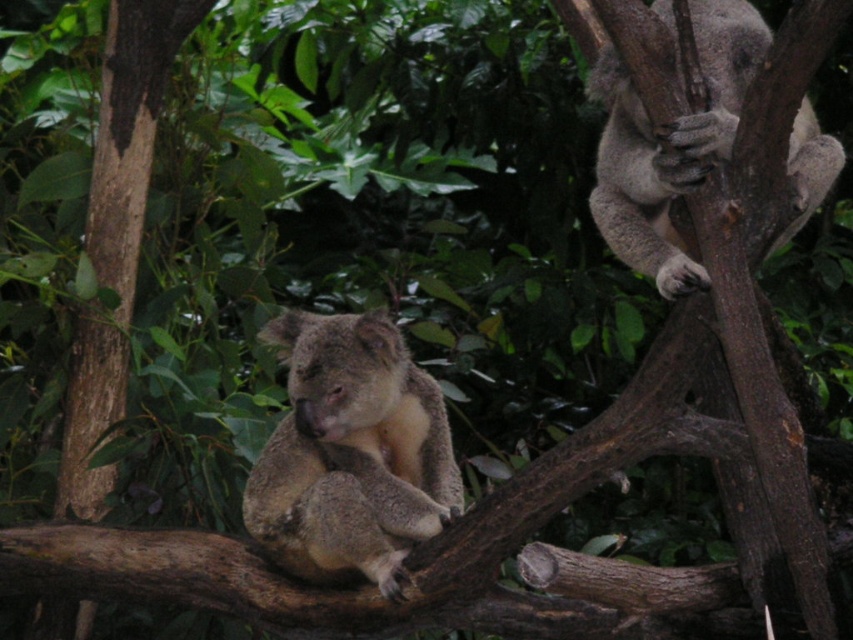
Question: From the image, what is the correct spatial relationship of fuzzy brown koala at center in relation to fuzzy gray koala at upper right?

Choices:
 (A) below
 (B) above

Answer: (A)

Question: Is the position of fuzzy brown koala at center less distant than that of fuzzy gray koala at upper right?

Choices:
 (A) no
 (B) yes

Answer: (A)

Question: Can you confirm if fuzzy brown koala at center is thinner than fuzzy gray koala at upper right?

Choices:
 (A) yes
 (B) no

Answer: (B)

Question: Which of the following is the farthest from the observer?

Choices:
 (A) fuzzy gray koala at upper right
 (B) fuzzy brown koala at center

Answer: (B)